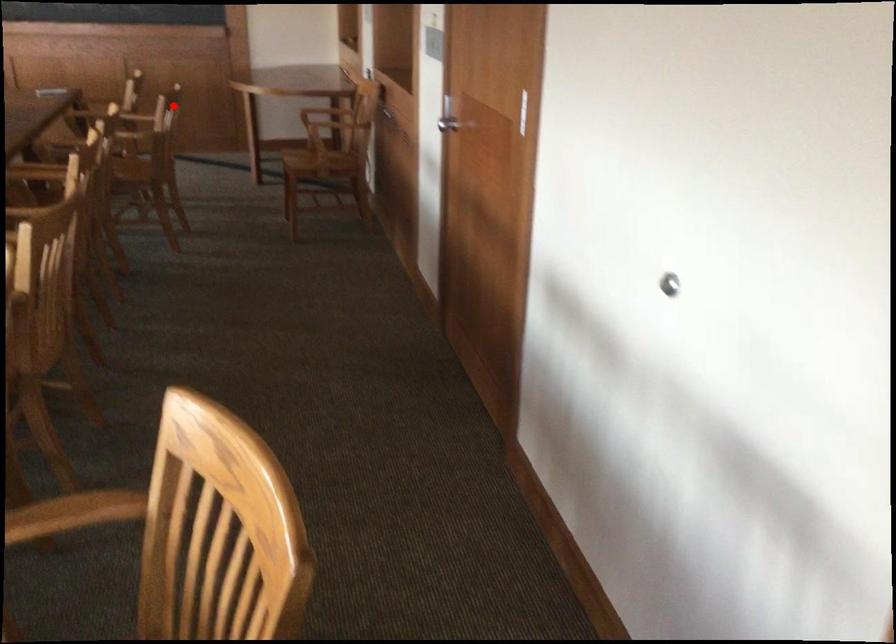
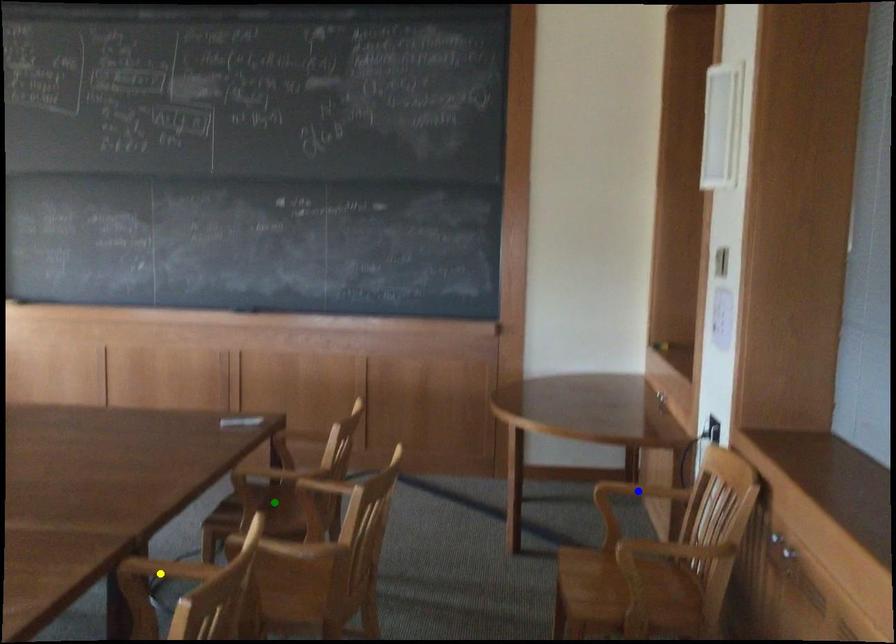
Question: I am providing you with two images of the same scene from different viewpoints. A red point is marked on the first image. You are given multiple points on the second image. Which point in image 2 represents the same 3d spot as the red point in image 1?

Choices:
 (A) green point
 (B) yellow point
 (C) blue point

Answer: (C)